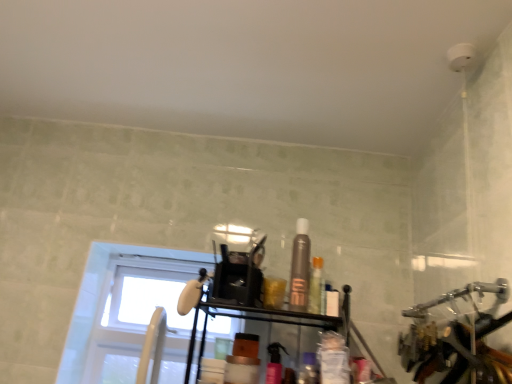
Question: Do you think white glass window at upper left is within satin brown spray can at center, the third toiletry positioned from the right, or outside of it?

Choices:
 (A) inside
 (B) outside

Answer: (B)

Question: In the image, is white glass window at upper left on the left side or the right side of satin brown spray can at center, the 2th toiletry in the left-to-right sequence?

Choices:
 (A) right
 (B) left

Answer: (B)

Question: Estimate the real-world distances between objects in this image. Which object is closer to the white glass window at upper left?

Choices:
 (A) pink glossy spray can at center, the fourth toiletry when ordered from right to left
 (B) translucent plastic bottle at center, the 4th toiletry viewed from the left
 (C) translucent plastic container at center, which is the 3th toiletry in left-to-right order
 (D) satin brown spray can at center, the 2th toiletry in the left-to-right sequence

Answer: (D)

Question: Considering the real-world distances, which object is closest to the translucent plastic container at center, which is the 3th toiletry in left-to-right order?

Choices:
 (A) translucent plastic bottle at center, which appears as the first toiletry when viewed from the right
 (B) satin brown spray can at center, the 2th toiletry in the left-to-right sequence
 (C) pink glossy spray can at center, which ranks as the first toiletry in left-to-right order
 (D) white glass window at upper left

Answer: (C)